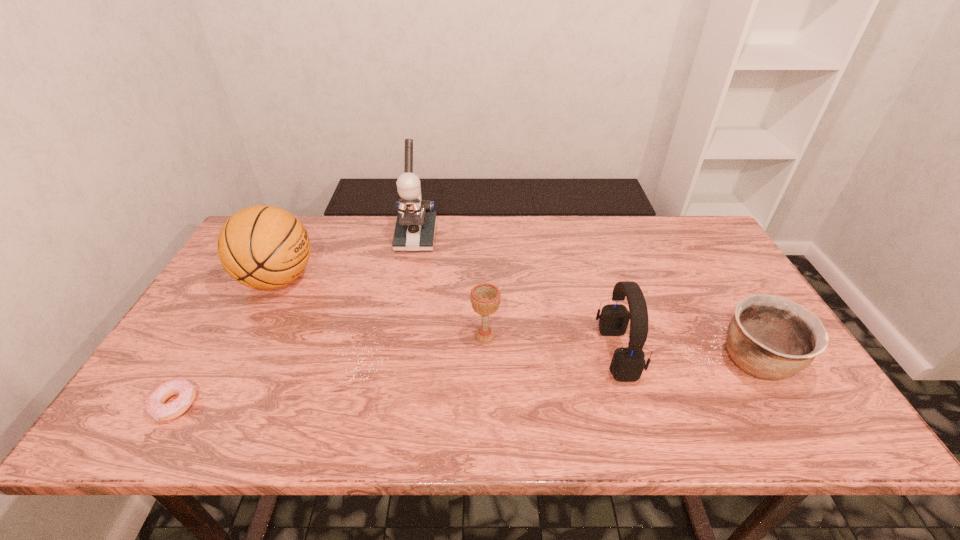
The height and width of the screenshot is (540, 960). I want to click on free space between the second object from right to left and the fifth nearest object, so click(x=447, y=316).

Identify the location of blank region between the fifth object from left to right and the doughnut. Image resolution: width=960 pixels, height=540 pixels. (396, 379).

Find the location of a particular element. The image size is (960, 540). free space that is in between the headset and the shortest object is located at coordinates (396, 379).

You are a GUI agent. You are given a task and a screenshot of the screen. Output one action in this format:
    pyautogui.click(x=<x>, y=<y>)
    Task: Click on the unoccupied position between the second farthest object and the chalice
    Image resolution: width=960 pixels, height=540 pixels.
    Given the screenshot: What is the action you would take?
    pyautogui.click(x=381, y=308)

Find the location of `free space between the farthest object and the fifth object from left to right`. free space between the farthest object and the fifth object from left to right is located at coordinates (516, 295).

You are a GUI agent. You are given a task and a screenshot of the screen. Output one action in this format:
    pyautogui.click(x=<x>, y=<y>)
    Task: Click on the free spot between the fifth object from left to right and the doughnut
    
    Given the screenshot: What is the action you would take?
    pyautogui.click(x=396, y=379)

This screenshot has width=960, height=540. I want to click on vacant space that's between the fifth object from left to right and the pottery, so click(686, 357).

This screenshot has height=540, width=960. Identify the location of blank region between the farthest object and the fifth nearest object. (347, 258).

Choose which object is the fourth nearest neighbor to the doughnut. Please provide its 2D coordinates. Your answer should be formatted as a tuple, i.e. [(x, y)], where the tuple contains the x and y coordinates of a point satisfying the conditions above.

[(628, 363)]

Locate which object ranks fourth in proximity to the microscope. Please provide its 2D coordinates. Your answer should be formatted as a tuple, i.e. [(x, y)], where the tuple contains the x and y coordinates of a point satisfying the conditions above.

[(155, 406)]